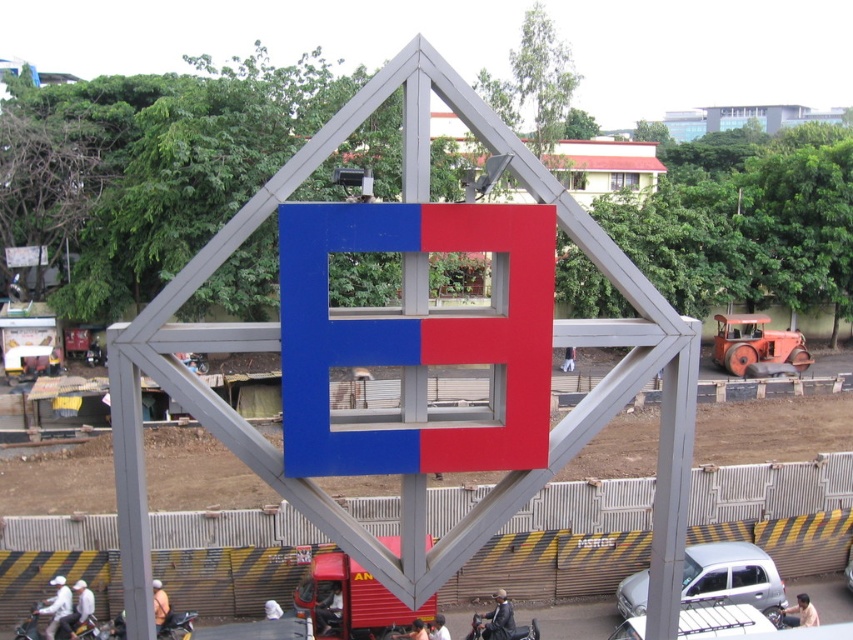
How much distance is there between silver metallic hatchback at center and white matte car at lower right?

silver metallic hatchback at center is 1.24 meters from white matte car at lower right.

Does point (759, 580) come behind point (703, 632)?

Yes.

The image size is (853, 640). In order to click on silver metallic hatchback at center in this screenshot , I will do `click(732, 576)`.

Does blue matte sign at center have a lesser height compared to black matte motorcycle at lower center?

Incorrect, blue matte sign at center's height does not fall short of black matte motorcycle at lower center's.

How far apart are blue matte sign at center and black matte motorcycle at lower center?

blue matte sign at center is 6.92 meters from black matte motorcycle at lower center.

Between point (534, 307) and point (477, 620), which one is positioned behind?

The point (477, 620) is more distant.

Find the location of `blue matte sign at center`. blue matte sign at center is located at coordinates (415, 336).

Which is more to the left, white matte car at lower right or black matte motorcycle at lower center?

Positioned to the left is black matte motorcycle at lower center.

Does white matte car at lower right appear under black matte motorcycle at lower center?

Incorrect, white matte car at lower right is not positioned below black matte motorcycle at lower center.

Which is behind, point (730, 604) or point (532, 632)?

The point (730, 604) is behind.

This screenshot has height=640, width=853. What are the coordinates of `white matte car at lower right` in the screenshot? It's located at (720, 620).